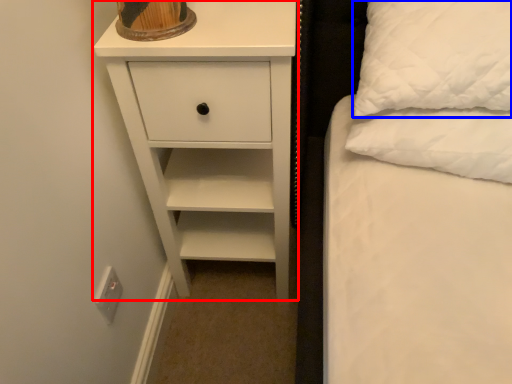
Question: Which point is further to the camera, chest of drawers (highlighted by a red box) or pillow (highlighted by a blue box)?

Choices:
 (A) chest of drawers
 (B) pillow

Answer: (A)